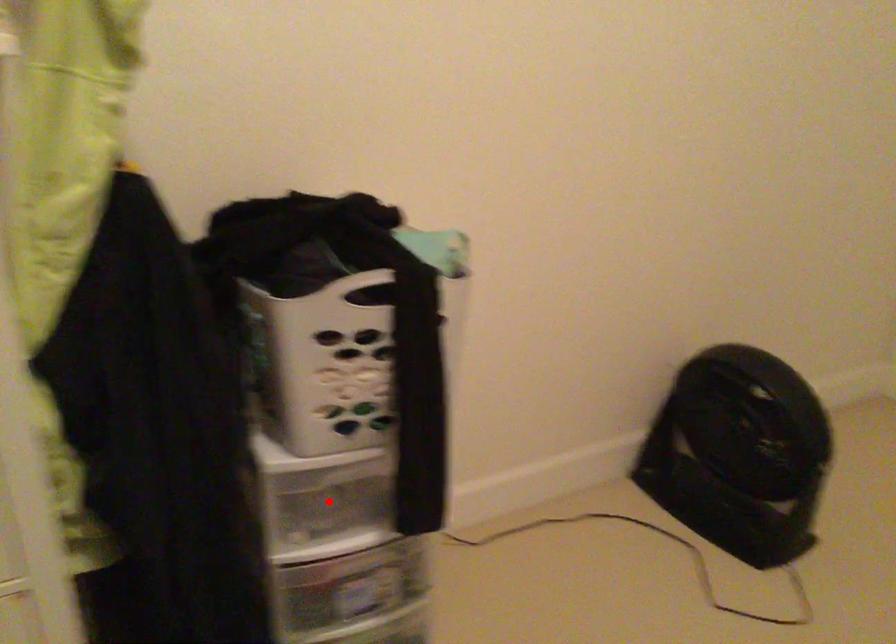
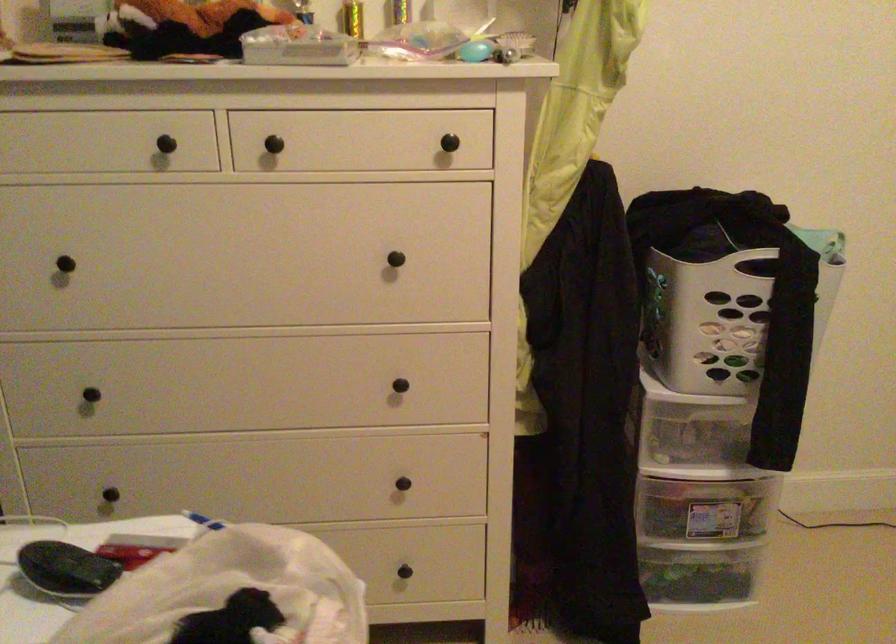
Question: I am providing you with two images of the same scene from different viewpoints. Given a red point in image1, look at the same physical point in image2. Is it:

Choices:
 (A) Closer to the viewpoint
 (B) Farther from the viewpoint

Answer: (B)